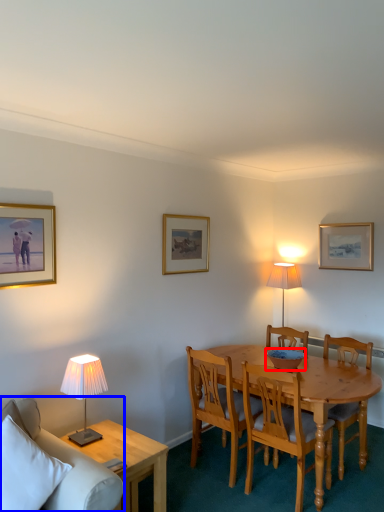
Question: Among these objects, which one is nearest to the camera, bowl (highlighted by a red box) or studio couch (highlighted by a blue box)?

Choices:
 (A) bowl
 (B) studio couch

Answer: (B)